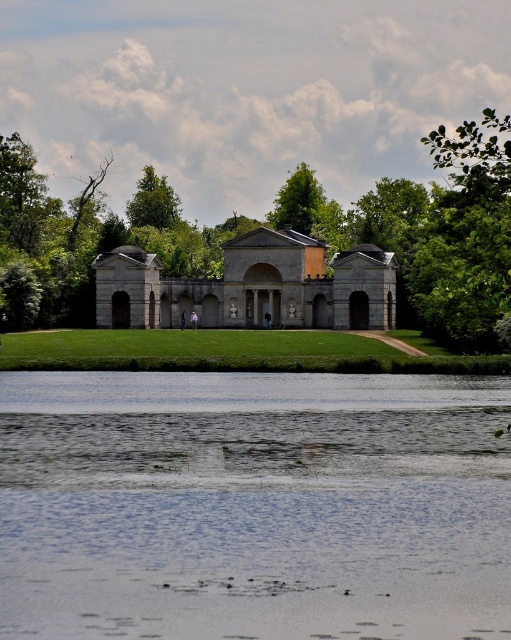
Can you confirm if light gray stone palace at center is positioned to the left of green leafy tree at upper center?

No, light gray stone palace at center is not to the left of green leafy tree at upper center.

Who is positioned more to the right, light gray stone palace at center or green leafy tree at upper center?

light gray stone palace at center is more to the right.

The height and width of the screenshot is (640, 511). What are the coordinates of `light gray stone palace at center` in the screenshot? It's located at pos(251,285).

Between clear water at lower center and green leafy tree at upper center, which one is positioned lower?

Positioned lower is clear water at lower center.

Is clear water at lower center above green leafy tree at upper center?

Actually, clear water at lower center is below green leafy tree at upper center.

Image resolution: width=511 pixels, height=640 pixels. Identify the location of clear water at lower center. (252, 504).

Can you confirm if clear water at lower center is positioned below green leafy tree at upper right?

Indeed, clear water at lower center is positioned under green leafy tree at upper right.

Is clear water at lower center bigger than green leafy tree at upper right?

Actually, clear water at lower center might be smaller than green leafy tree at upper right.

Does point (434, 602) lie behind point (455, 186)?

That is False.

Image resolution: width=511 pixels, height=640 pixels. What are the coordinates of `clear water at lower center` in the screenshot? It's located at (252, 504).